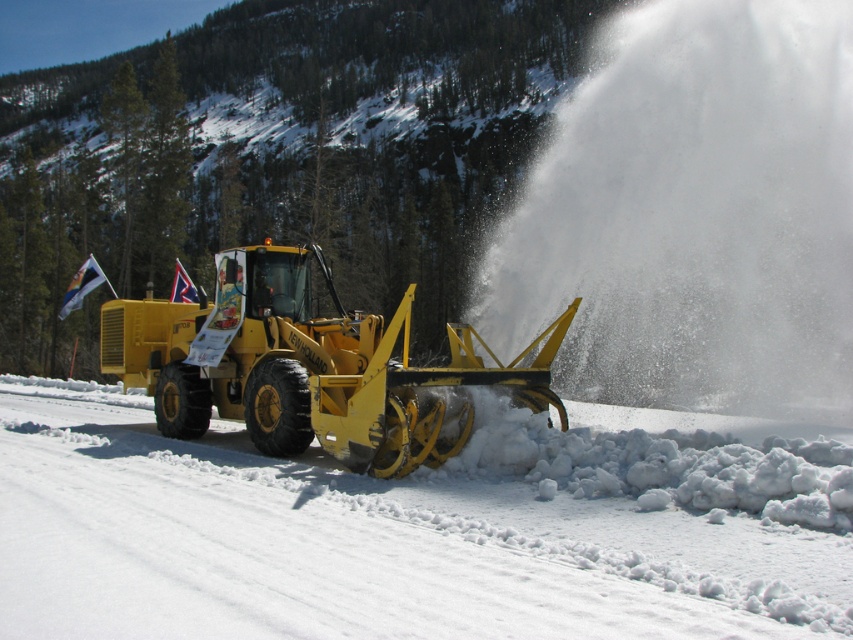
Does yellow rubber snowplow at center appear on the left side of yellow metallic snowplow at center?

In fact, yellow rubber snowplow at center is to the right of yellow metallic snowplow at center.

Is point (668, 560) more distant than point (183, 336)?

No, it is in front of (183, 336).

Is point (171, 566) closer to camera compared to point (300, 362)?

Yes, it is in front of point (300, 362).

The image size is (853, 640). I want to click on yellow rubber snowplow at center, so click(358, 545).